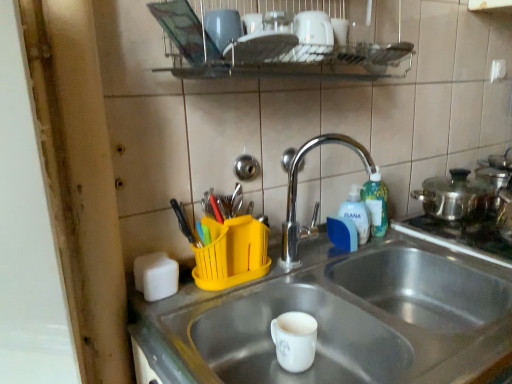
Where is `vacant area that is in front of green translucent bottle at right, the 1th bottle from the right`? The image size is (512, 384). vacant area that is in front of green translucent bottle at right, the 1th bottle from the right is located at coordinates (394, 244).